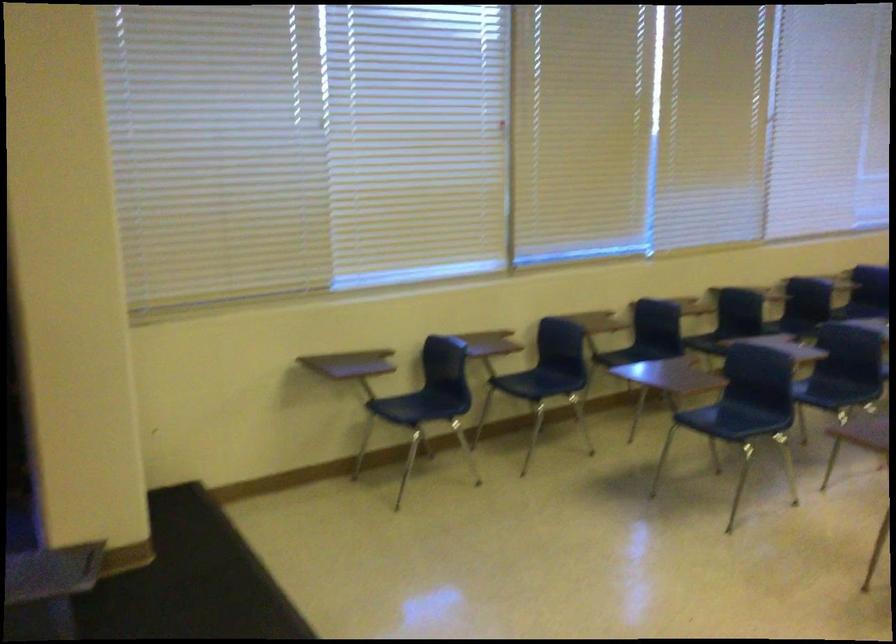
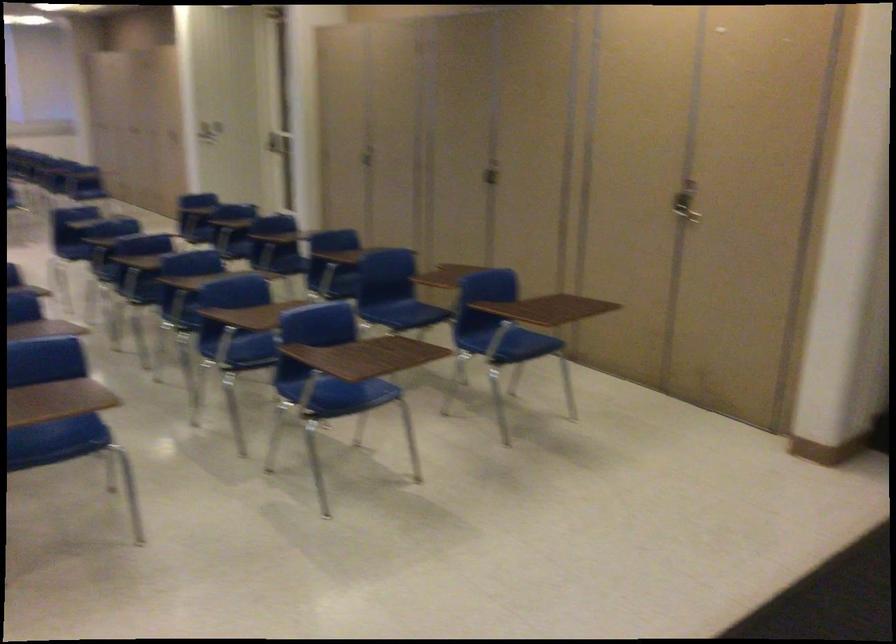
The images are taken continuously from a first-person perspective. In which direction is your viewpoint rotating?

The camera's rotation is toward right-down.